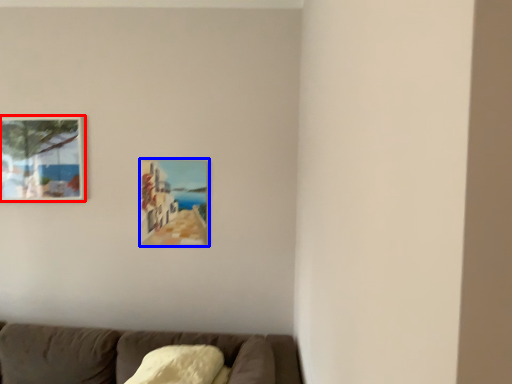
Question: Which object appears closest to the camera in this image, picture frame (highlighted by a red box) or picture frame (highlighted by a blue box)?

Choices:
 (A) picture frame
 (B) picture frame

Answer: (A)